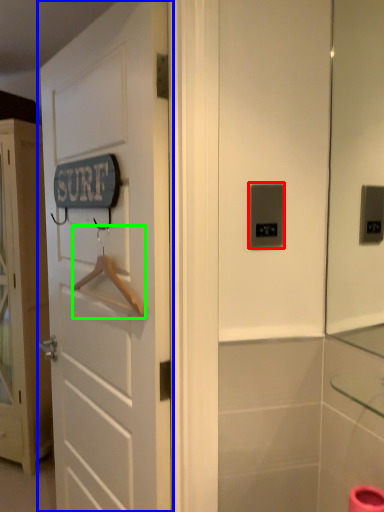
Question: Considering the real-world distances, which object is closest to light switch (highlighted by a red box)? door (highlighted by a blue box) or hanger (highlighted by a green box).

Choices:
 (A) door
 (B) hanger

Answer: (B)